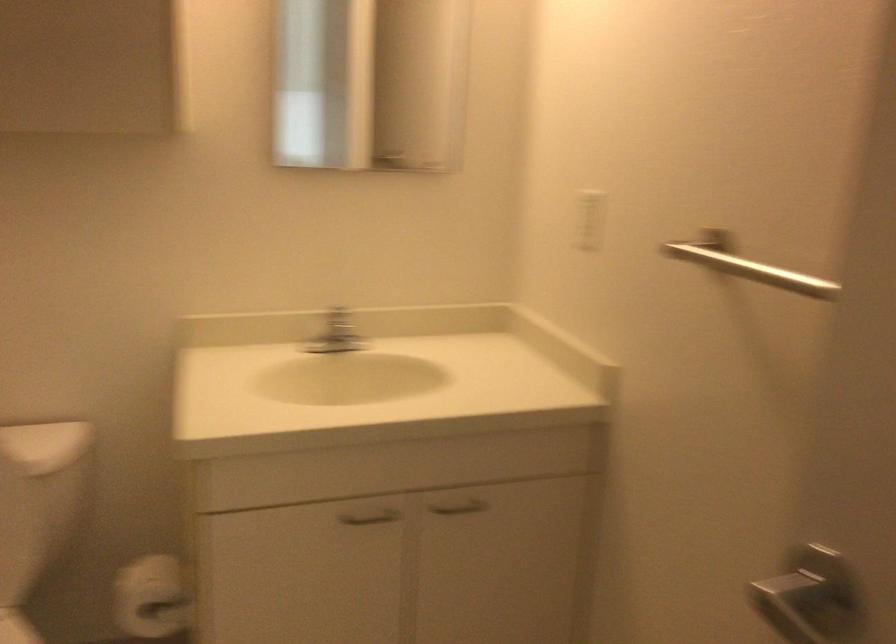
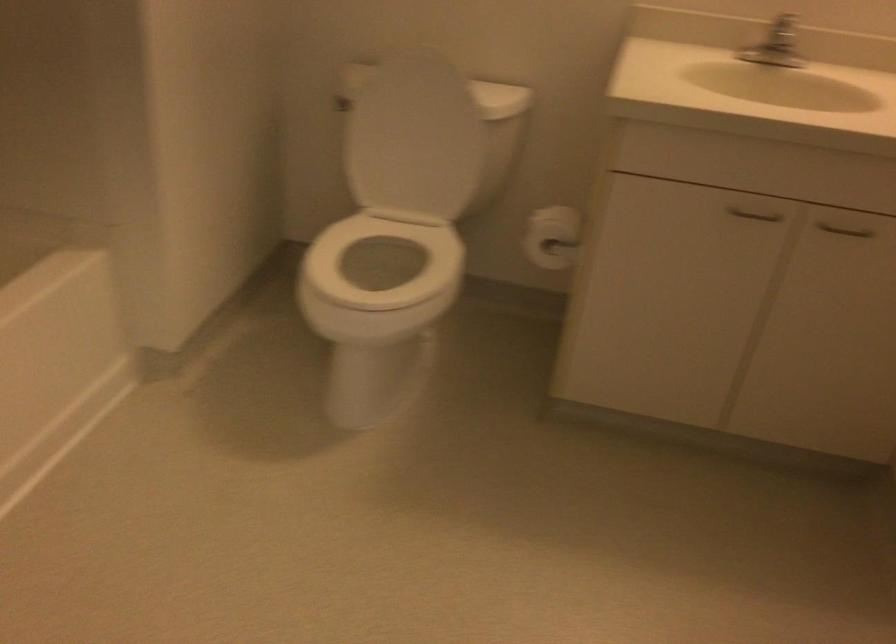
The point at (348,341) is marked in the first image. Where is the corresponding point in the second image?

(778, 55)